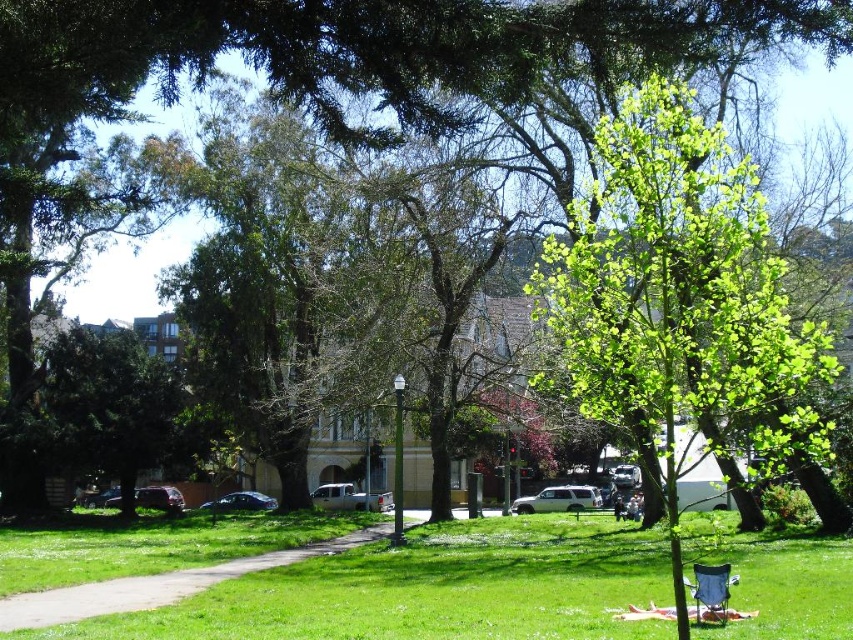
You are standing in the park and want to take a photo of the two points mentioned. Which point, point (x=9, y=625) or point (x=711, y=602), will appear closer to the camera in your photo?

Point (x=9, y=625) is further to the camera than point (x=711, y=602), so it will appear closer to the camera in the photo.

You are standing at the entrance of the park and want to take a photo of the green leafy tree at center. According to the coordinates given, where should you position yourself to ensure the tree is centered in your camera view?

The green leafy tree at center is located at coordinates point (x=680, y=301), so you should position yourself so that the camera view centers on that coordinate point to capture the tree in the middle of the frame.

You are standing at the center of the park and want to find the green grassy path at lower left. According to the coordinates provided, in which direction should you walk to reach it?

The green grassy path at lower left is located at coordinates point (155, 586). Since the lower left corner of the image is typically associated with lower x and y values, but the x coordinate here is 0.916 which is closer to the right side, you should walk towards the right direction to reach it.